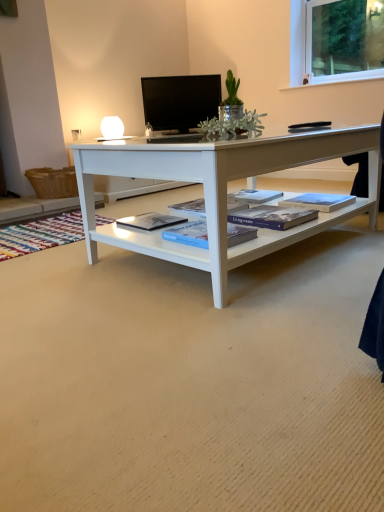
Question: Considering the positions of black glossy tv at upper center and hardcover book at center, the 4th book viewed from the right, in the image, is black glossy tv at upper center bigger or smaller than hardcover book at center, the 4th book viewed from the right,?

Choices:
 (A) big
 (B) small

Answer: (A)

Question: From a real-world perspective, is black glossy tv at upper center positioned above or below hardcover book at center, the first book positioned from the left?

Choices:
 (A) below
 (B) above

Answer: (B)

Question: Based on their relative distances, which object is farther from the black glossy tv at upper center?

Choices:
 (A) hardcover book at center, the first book positioned from the left
 (B) blue matte book at center, marked as the second book in a left-to-right arrangement
 (C) blue hardcover book at center, which is the 1th book in right-to-left order
 (D) blue matte book at center, arranged as the 3th book when viewed from the left

Answer: (B)

Question: Estimate the real-world distances between objects in this image. Which object is closer to the blue matte book at center, the 2th book when ordered from right to left?

Choices:
 (A) blue hardcover book at center, which is the 1th book in right-to-left order
 (B) hardcover book at center, the first book positioned from the left
 (C) black glossy tv at upper center
 (D) blue matte book at center, arranged as the third book when viewed from the right

Answer: (D)